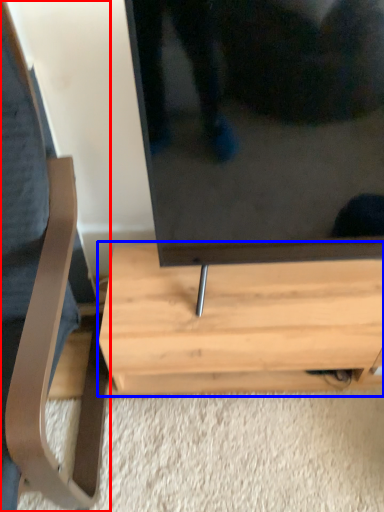
Question: Which object appears farthest to the camera in this image, furniture (highlighted by a red box) or table (highlighted by a blue box)?

Choices:
 (A) furniture
 (B) table

Answer: (B)